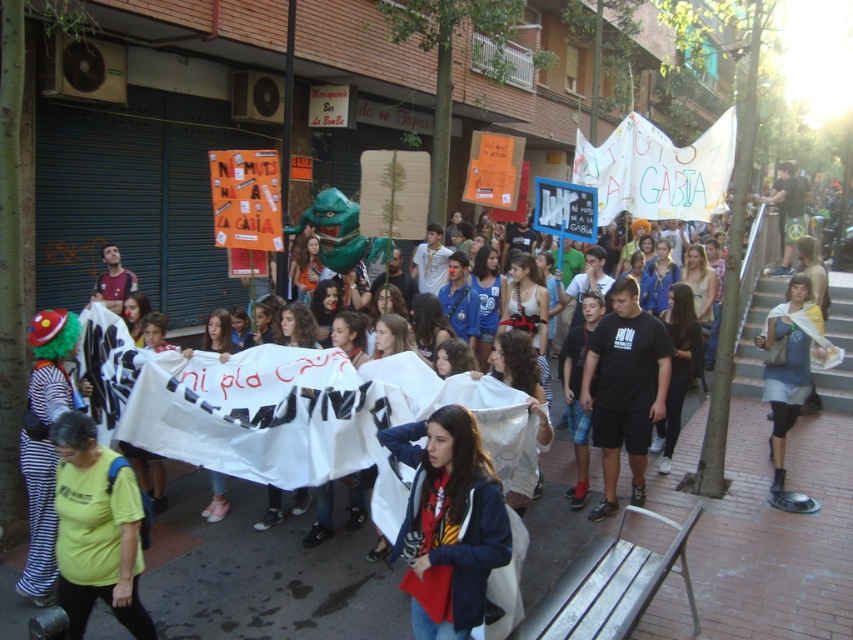
Based on the provided scene description, where is the dark blue jacket at center located in terms of its 2D coordinates?

The dark blue jacket at center is located at the 2D coordinates point (448, 522).

You are a photographer standing at the camera position. You want to take a photo of the point at coordinates point (428, 488). Is the point within your camera range of 3 meters?

The point at coordinates point (428, 488) is 3.27 meters from the camera, which is beyond the camera range of 3 meters. Therefore, the point is out of range.

You are a photographer standing at the edge of the protest crowd. You want to take a photo that includes both the white fabric banner at center and the denim skirt at center. Given that your camera has a minimum focus distance of 1.5 meters, will you be able to capture both objects in the same frame without moving closer?

The white fabric banner at center and the denim skirt at center are 1.36 meters apart, which is within the camera minimum focus distance of 1.5 meters. Therefore, you can capture both objects in the same frame without moving closer.